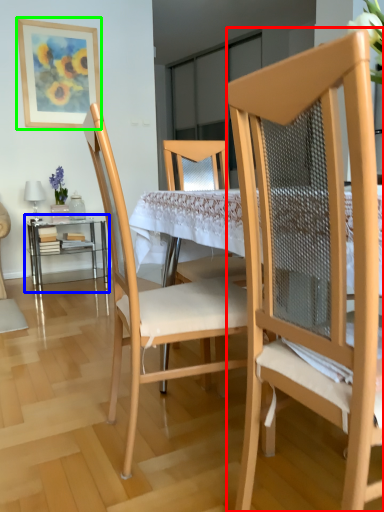
Question: Considering the real-world distances, which object is closest to chair (highlighted by a red box)? table (highlighted by a blue box) or picture frame (highlighted by a green box).

Choices:
 (A) table
 (B) picture frame

Answer: (A)